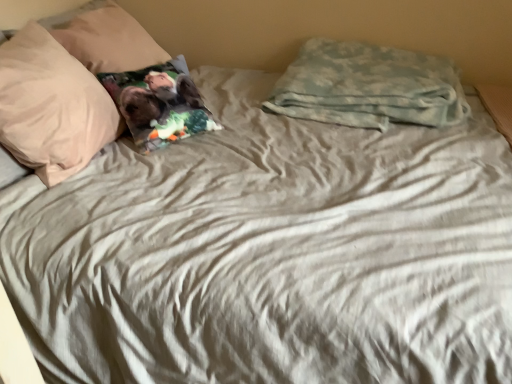
Question: Could you tell me if printed fabric pillow at upper left, which is counted as the 3th pillow, starting from the left, is facing camouflage fabric pillow at upper right, the 4th pillow in the left-to-right sequence?

Choices:
 (A) no
 (B) yes

Answer: (B)

Question: Are printed fabric pillow at upper left, which is counted as the 3th pillow, starting from the left, and camouflage fabric pillow at upper right, the 4th pillow in the left-to-right sequence, far apart?

Choices:
 (A) yes
 (B) no

Answer: (B)

Question: Is printed fabric pillow at upper left, the 2th pillow positioned from the right, positioned beyond the bounds of camouflage fabric pillow at upper right, which is the first pillow from right to left?

Choices:
 (A) yes
 (B) no

Answer: (A)

Question: Is the position of printed fabric pillow at upper left, which is counted as the 3th pillow, starting from the left, more distant than that of camouflage fabric pillow at upper right, which is the first pillow from right to left?

Choices:
 (A) yes
 (B) no

Answer: (B)

Question: Does printed fabric pillow at upper left, which is counted as the 3th pillow, starting from the left, have a greater width compared to camouflage fabric pillow at upper right, which is the first pillow from right to left?

Choices:
 (A) no
 (B) yes

Answer: (A)

Question: Is point (59, 137) positioned closer to the camera than point (211, 122)?

Choices:
 (A) farther
 (B) closer

Answer: (B)

Question: From a real-world perspective, is beige soft pillow at upper left, which is the fourth pillow in right-to-left order, physically located above or below printed fabric pillow at upper left, which is counted as the 3th pillow, starting from the left?

Choices:
 (A) above
 (B) below

Answer: (A)

Question: In the image, is beige soft pillow at upper left, arranged as the 1th pillow when viewed from the left, positioned in front of or behind printed fabric pillow at upper left, which is counted as the 3th pillow, starting from the left?

Choices:
 (A) front
 (B) behind

Answer: (A)

Question: Which is correct: beige soft pillow at upper left, which is the fourth pillow in right-to-left order, is inside printed fabric pillow at upper left, the 2th pillow positioned from the right, or outside of it?

Choices:
 (A) inside
 (B) outside

Answer: (B)

Question: Which is correct: beige soft pillow at upper left, which is the fourth pillow in right-to-left order, is inside camouflage fabric pillow at upper right, the 4th pillow in the left-to-right sequence, or outside of it?

Choices:
 (A) inside
 (B) outside

Answer: (B)

Question: From the image's perspective, relative to camouflage fabric pillow at upper right, the 4th pillow in the left-to-right sequence, is beige soft pillow at upper left, which is the fourth pillow in right-to-left order, above or below?

Choices:
 (A) above
 (B) below

Answer: (B)

Question: Considering the positions of beige soft pillow at upper left, arranged as the 1th pillow when viewed from the left, and camouflage fabric pillow at upper right, the 4th pillow in the left-to-right sequence, in the image, is beige soft pillow at upper left, arranged as the 1th pillow when viewed from the left, bigger or smaller than camouflage fabric pillow at upper right, the 4th pillow in the left-to-right sequence,?

Choices:
 (A) big
 (B) small

Answer: (B)

Question: In the image, is beige soft pillow at upper left, arranged as the 1th pillow when viewed from the left, positioned in front of or behind camouflage fabric pillow at upper right, which is the first pillow from right to left?

Choices:
 (A) front
 (B) behind

Answer: (A)

Question: Considering the positions of point (138, 38) and point (102, 87), is point (138, 38) closer or farther from the camera than point (102, 87)?

Choices:
 (A) closer
 (B) farther

Answer: (B)

Question: In the image, is printed fabric pillow at left, the second pillow when ordered from left to right, positioned in front of or behind beige soft pillow at upper left, which is the fourth pillow in right-to-left order?

Choices:
 (A) front
 (B) behind

Answer: (B)